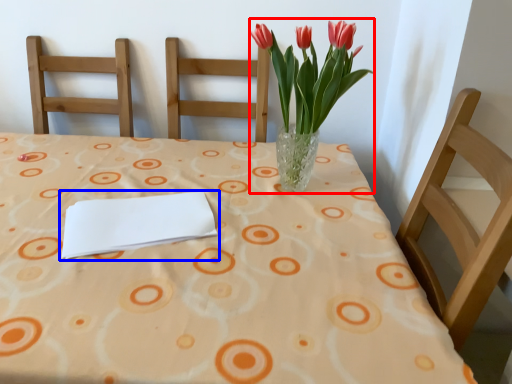
Question: Which point is closer to the camera, floral arrangement (highlighted by a red box) or journal (highlighted by a blue box)?

Choices:
 (A) floral arrangement
 (B) journal

Answer: (B)